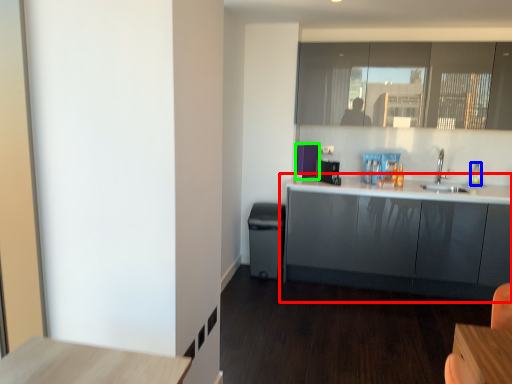
Question: Estimate the real-world distances between objects in this image. Which object is closer to cabinetry (highlighted by a red box), bottle (highlighted by a blue box) or appliance (highlighted by a green box)?

Choices:
 (A) bottle
 (B) appliance

Answer: (B)